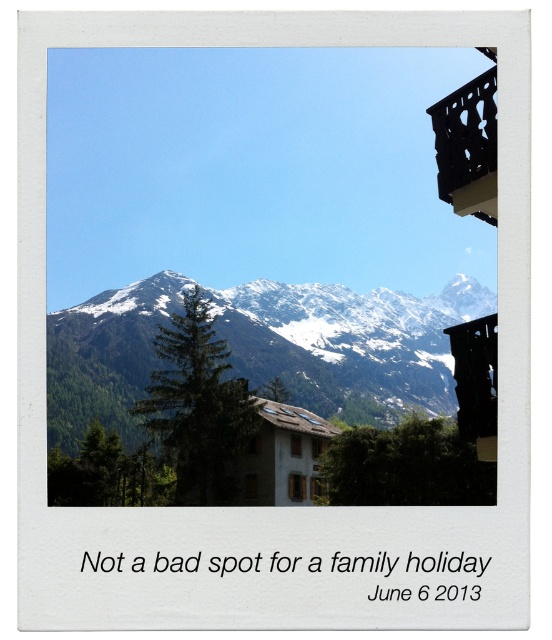
Question: Which object is farther from the camera taking this photo?

Choices:
 (A) black wrought iron balcony at upper right
 (B) snowy rock mountain range at center

Answer: (B)

Question: Which point is farther to the camera?

Choices:
 (A) black wood balcony at upper right
 (B) snowy rock mountain range at center
 (C) black wrought iron balcony at upper right

Answer: (B)

Question: Estimate the real-world distances between objects in this image. Which object is closer to the black wrought iron balcony at upper right?

Choices:
 (A) black wood balcony at upper right
 (B) snowy rock mountain range at center

Answer: (A)

Question: Can you confirm if snowy rock mountain range at center is bigger than black wood balcony at upper right?

Choices:
 (A) yes
 (B) no

Answer: (A)

Question: Is snowy rock mountain range at center further to the viewer compared to black wrought iron balcony at upper right?

Choices:
 (A) yes
 (B) no

Answer: (A)

Question: Is snowy rock mountain range at center to the right of black wood balcony at upper right from the viewer's perspective?

Choices:
 (A) no
 (B) yes

Answer: (A)